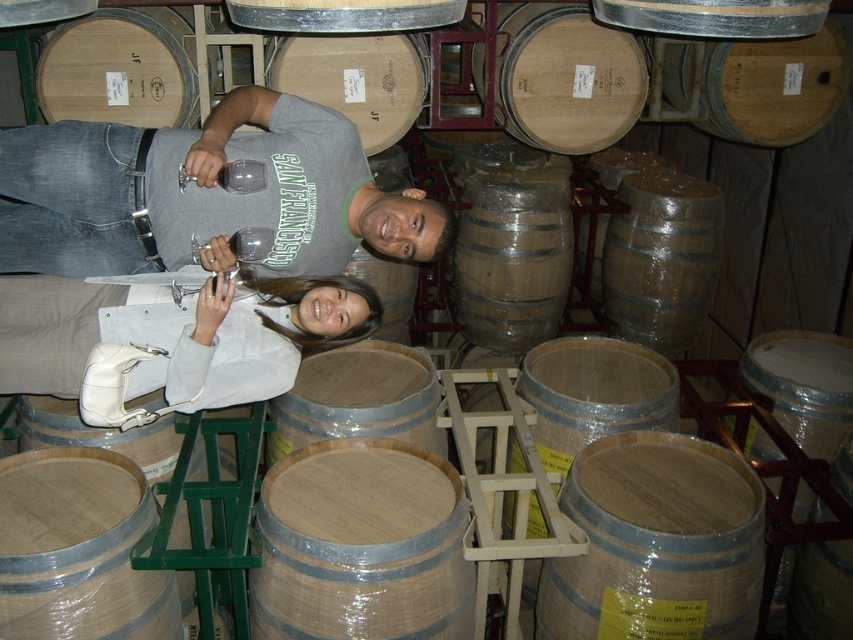
Can you confirm if matte gray t-shirt at center is shorter than white leather purse at lower center?

No, matte gray t-shirt at center is not shorter than white leather purse at lower center.

Can you confirm if matte gray t-shirt at center is bigger than white leather purse at lower center?

Correct, matte gray t-shirt at center is larger in size than white leather purse at lower center.

You are a GUI agent. You are given a task and a screenshot of the screen. Output one action in this format:
    pyautogui.click(x=<x>, y=<y>)
    Task: Click on the matte gray t-shirt at center
    The width and height of the screenshot is (853, 640).
    Given the screenshot: What is the action you would take?
    pyautogui.click(x=204, y=193)